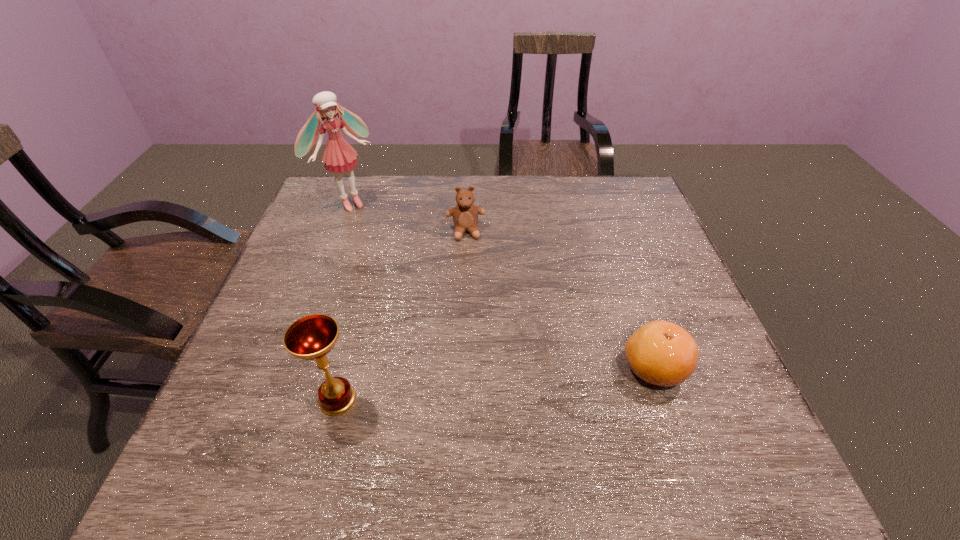
This screenshot has width=960, height=540. I want to click on vacant spot on the desktop that is between the chalice and the rightmost object and is positioned on the front-facing side of the second farthest object, so click(485, 385).

Identify the location of free space on the desktop that is between the chalice and the clementine and is positioned on the front-facing side of the doll. coord(517,382).